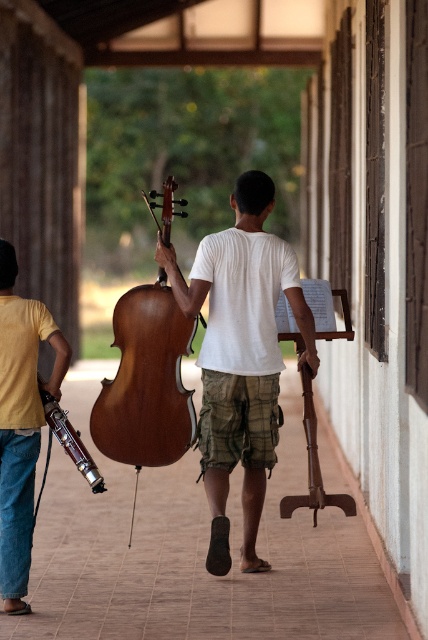
You are a music teacher observing two students carrying instruments in the walkway. You need to determine which instrument is taller between the shiny brown cello at center and the wooden violin at center. Which one is taller?

The shiny brown cello at center is taller than the wooden violin at center.

You are a photographer standing at the entrance of the covered walkway. You want to capture a photo of the wooden cello at center. Where should you position your camera to ensure the cello is centered in the frame?

You should position your camera at point (240, 356) to ensure the wooden cello at center is centered in the frame.